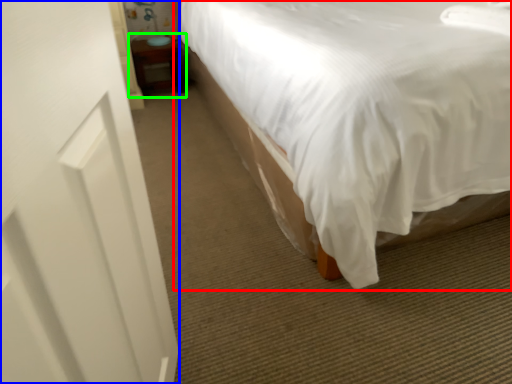
Question: Based on their relative distances, which object is farther from bed (highlighted by a red box)? Choose from screen door (highlighted by a blue box) and table (highlighted by a green box).

Choices:
 (A) screen door
 (B) table

Answer: (B)